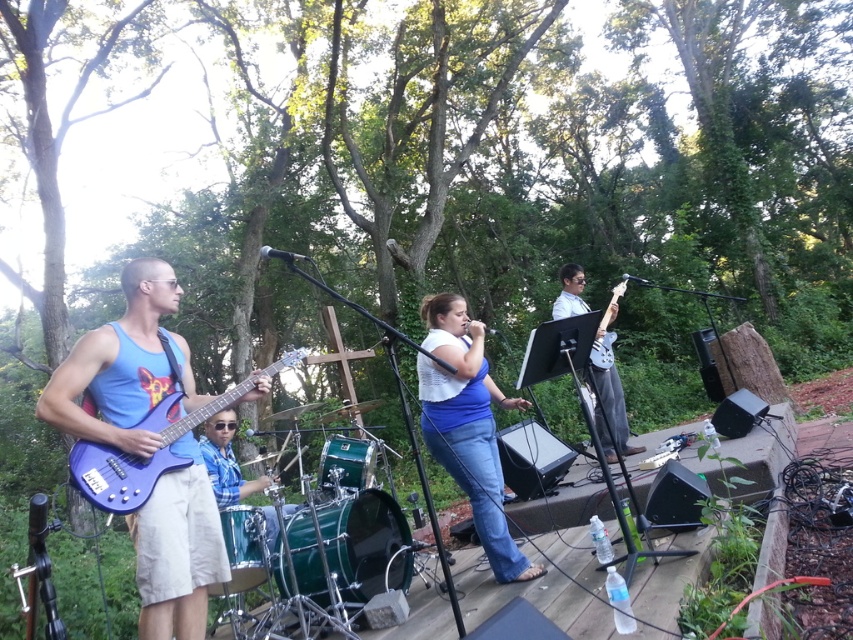
Question: Which object is closer to the camera taking this photo?

Choices:
 (A) matte black guitar at center
 (B) blue denim jeans at center

Answer: (B)

Question: Among these objects, which one is farthest from the camera?

Choices:
 (A) matte black guitar at center
 (B) matte blue electric guitar at left
 (C) blue denim jeans at center
 (D) matte blue guitar at left

Answer: (A)

Question: Is matte blue guitar at left to the left of matte black guitar at center from the viewer's perspective?

Choices:
 (A) yes
 (B) no

Answer: (A)

Question: Which is nearer to the matte blue electric guitar at left?

Choices:
 (A) blue denim jeans at center
 (B) matte blue guitar at left
 (C) matte black guitar at center

Answer: (B)

Question: Can you confirm if matte blue guitar at left is positioned below matte blue electric guitar at left?

Choices:
 (A) yes
 (B) no

Answer: (A)

Question: Where is blue denim jeans at center located in relation to matte black guitar at center in the image?

Choices:
 (A) left
 (B) right

Answer: (A)